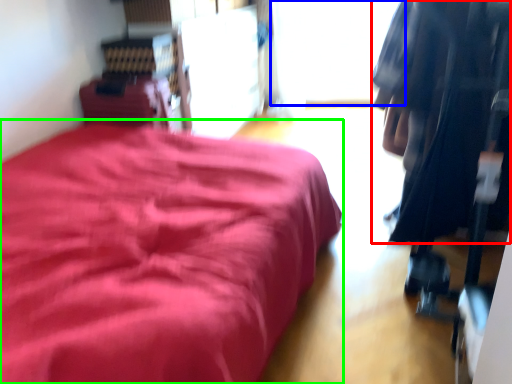
Question: Which object is positioned farthest from clothing (highlighted by a red box)? Select from window (highlighted by a blue box) and furniture (highlighted by a green box).

Choices:
 (A) window
 (B) furniture

Answer: (A)